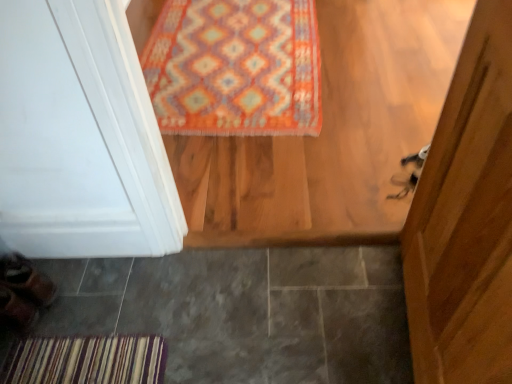
You are a GUI agent. You are given a task and a screenshot of the screen. Output one action in this format:
    pyautogui.click(x=<x>, y=<y>)
    Task: Click on the unoccupied area in front of brown leather shoe at lower left, the second shoe from the bottom
    The width and height of the screenshot is (512, 384).
    Given the screenshot: What is the action you would take?
    (31, 346)